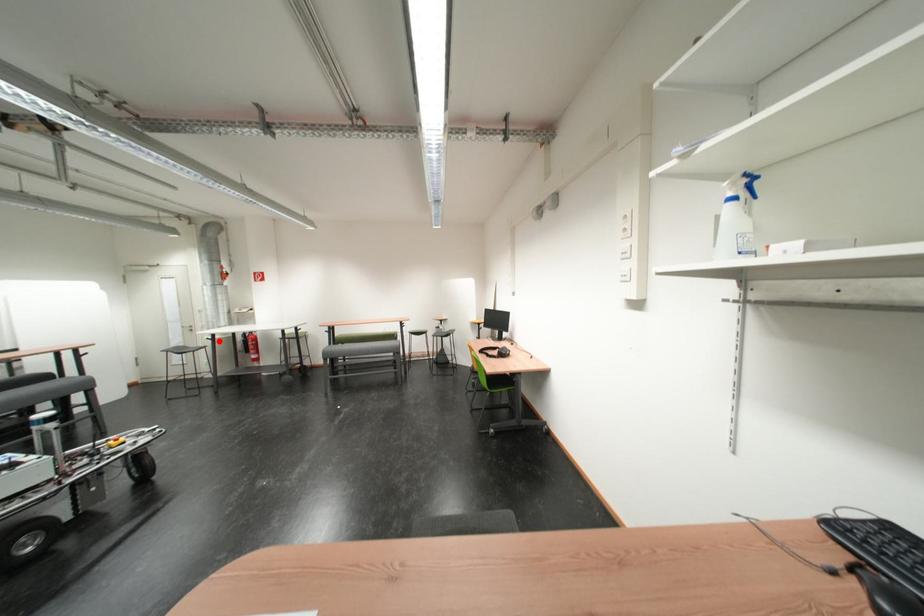
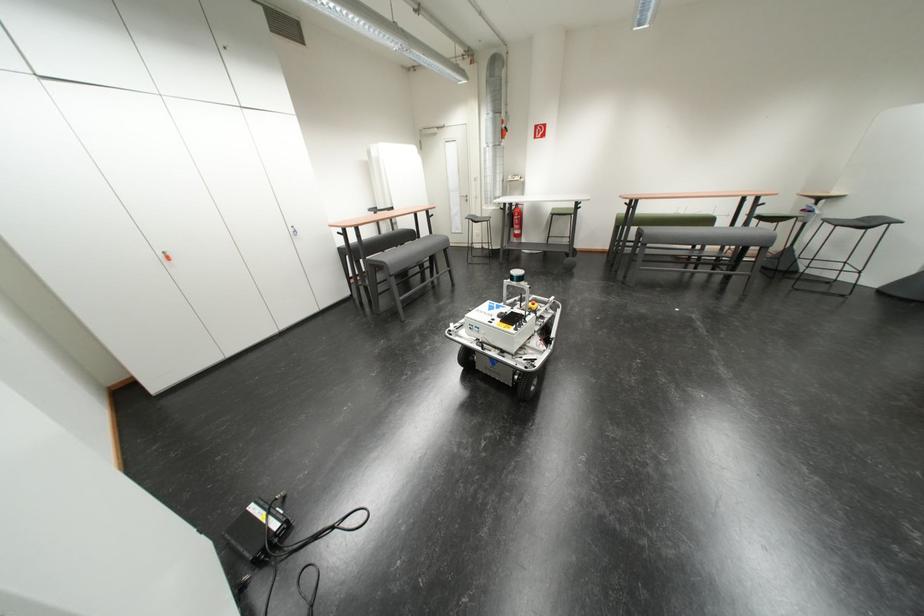
Question: I am providing you with two images of the same scene from different viewpoints. A red point is marked on the first image. Can you still see the location of the red point in image 2?

Choices:
 (A) Yes
 (B) No

Answer: (A)